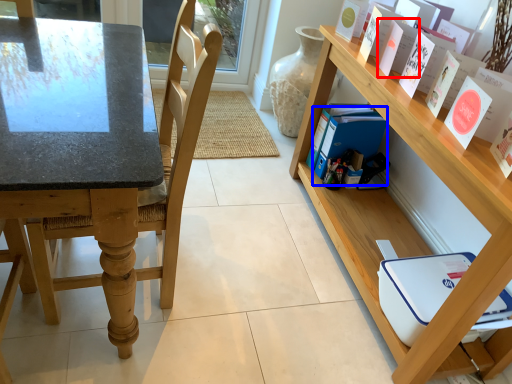
Question: Which object is further to the camera taking this photo, paperback book (highlighted by a red box) or paperback book (highlighted by a blue box)?

Choices:
 (A) paperback book
 (B) paperback book

Answer: (B)